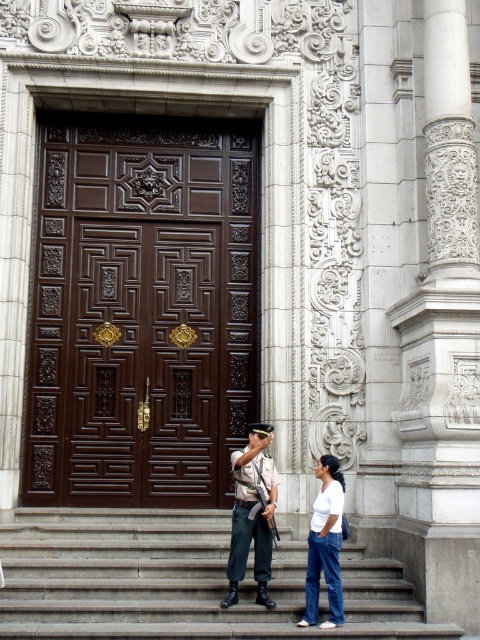
You are a painter who wants to paint the scene. You notice the white stone column at right and the white cotton shirt at lower center. Which object is wider?

The white stone column at right is wider than the white cotton shirt at lower center.

Based on the provided scene description, can you identify the object located at the coordinate point (443, 344)?

The point (443, 344) marks a white stone column at right.